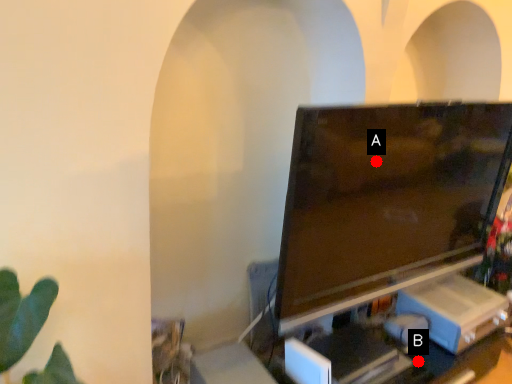
Question: Two points are circled on the image, labeled by A and B beside each circle. Which point is farther to the camera?

Choices:
 (A) A is further
 (B) B is further

Answer: (B)